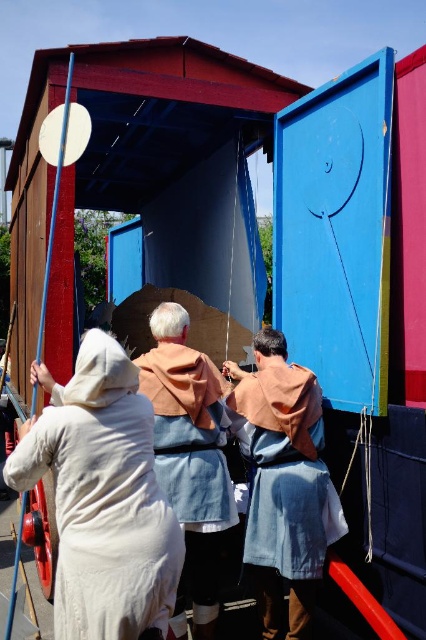
Is white cotton dress at lower left smaller than white linen dress at center?

Incorrect, white cotton dress at lower left is not smaller in size than white linen dress at center.

Is white cotton dress at lower left above white linen dress at center?

Yes.

Between point (69, 544) and point (229, 481), which one is positioned behind?

Point (229, 481)

Locate an element on the screen. Image resolution: width=426 pixels, height=640 pixels. white cotton dress at lower left is located at coordinates (103, 499).

Does white cotton dress at lower left lie in front of denim fabric robe at center?

That is True.

Based on the photo, can you confirm if white cotton dress at lower left is wider than denim fabric robe at center?

Correct, the width of white cotton dress at lower left exceeds that of denim fabric robe at center.

Find the location of a particular element. The width and height of the screenshot is (426, 640). white cotton dress at lower left is located at coordinates (103, 499).

This screenshot has width=426, height=640. I want to click on white cotton dress at lower left, so click(103, 499).

Between point (271, 372) and point (227, 492), which one is positioned behind?

The point (271, 372) is more distant.

Measure the distance between point (270, 522) and camera.

Point (270, 522) is 13.09 feet from camera.

Find the location of `denim fabric robe at center`. denim fabric robe at center is located at coordinates (284, 483).